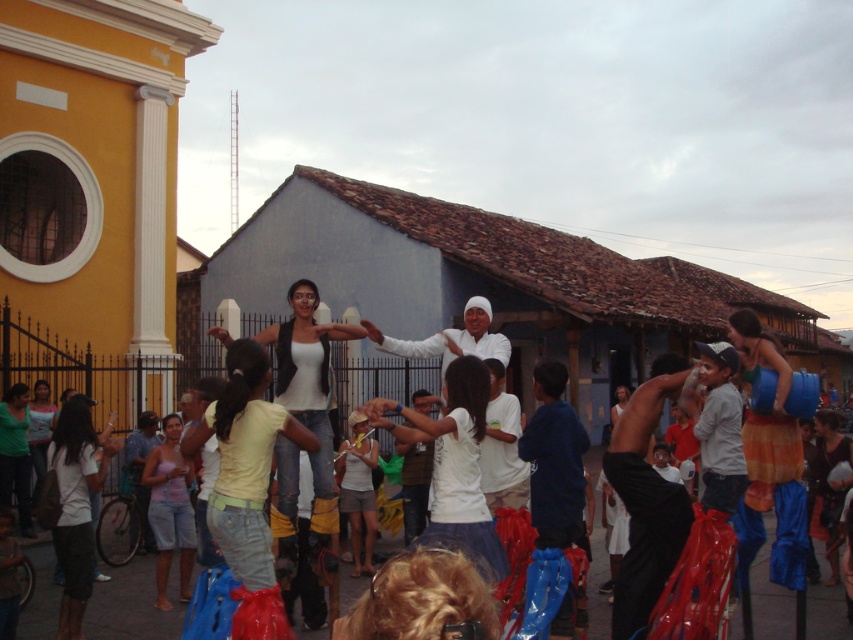
You are a photographer standing at the back of the crowd in the street scene. You want to take a photo that includes both the white cotton shirt at center and the white cotton shirt at lower left. Which shirt should you adjust your camera angle to focus on first to ensure both are in frame?

The white cotton shirt at center is located above the white cotton shirt at lower left. To include both in the frame, you should focus on the white cotton shirt at center first, then adjust your angle downward to include the one at lower left.

You are a photographer trying to capture a group photo of the people in the scene. You notice the white cotton shirt at center and the matte green shirt at lower left. Which person should you adjust the camera angle to focus on first to ensure both are in frame?

Result: The white cotton shirt at center is not as tall as the matte green shirt at lower left, so you should focus on the taller matte green shirt at lower left first to ensure the camera angle accommodates both heights.

You are a photographer trying to capture the dancers in the center of the street scene. You notice two white clothing items in the frame. Which clothing item has a smaller width, the white matte tank top at center or the white cotton shirt at lower left?

The white matte tank top at center has a smaller width than the white cotton shirt at lower left.